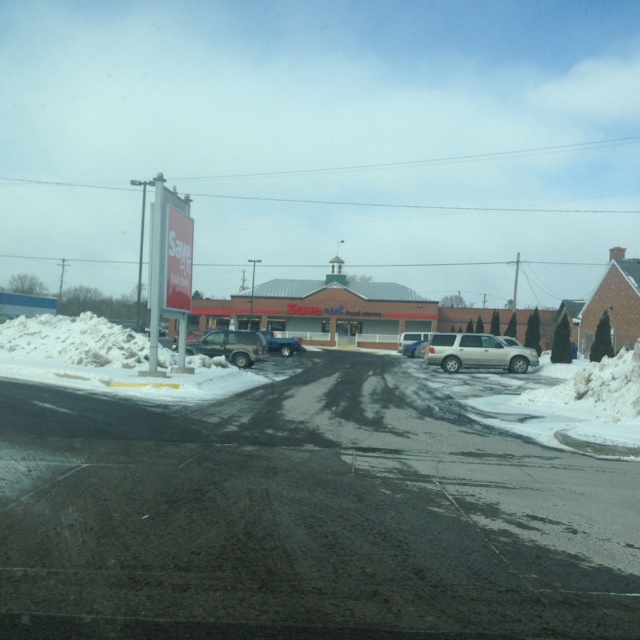
In the scene shown: You are a delivery driver who needs to park your blue matte truck at center in the commercial area. The parking lot has a designated parking spot at point 0.537, 0.439. Is your truck currently parked in the correct spot?

Yes, the blue matte truck at center is already positioned at point [280,342], which matches the designated parking spot coordinates.

You are a delivery person needing to park your vehicle in the Save A Lot parking lot. The parking space is only 1.8 meters tall. Which vehicle between the silver metallic suv at center and the blue matte truck at center would you choose to park there?

The silver metallic suv at center has a greater height compared to the blue matte truck at center. Since the parking space is only 1.8 meters tall, the blue matte truck at center would be the safer choice as it is shorter and less likely to hit the height restriction.